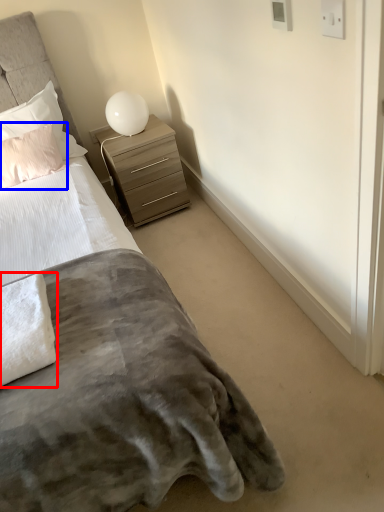
Question: Which point is closer to the camera, material (highlighted by a red box) or pillow (highlighted by a blue box)?

Choices:
 (A) material
 (B) pillow

Answer: (A)